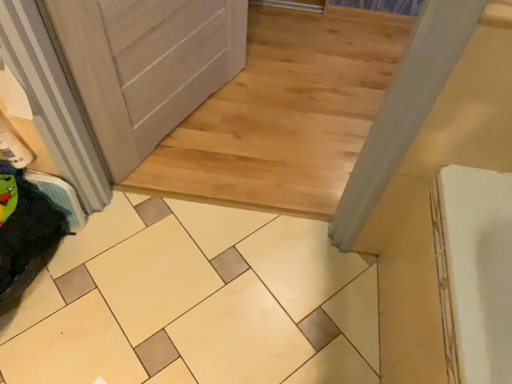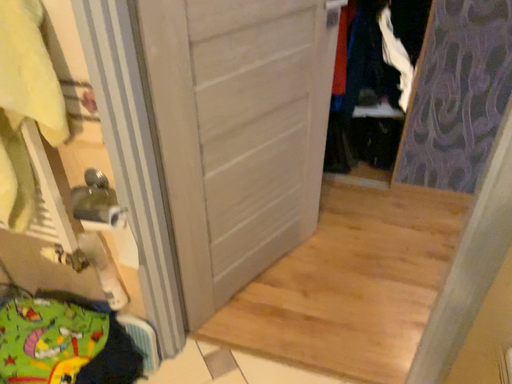
Question: How did the camera likely rotate when shooting the video?

Choices:
 (A) rotated upward
 (B) rotated downward

Answer: (A)